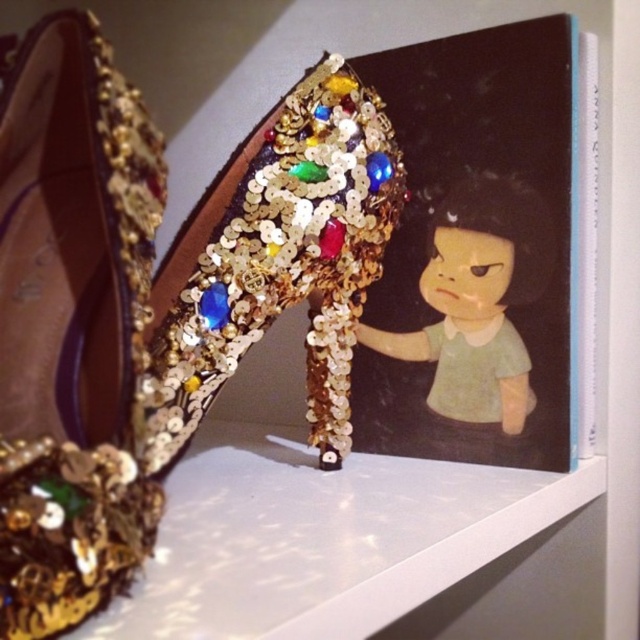
Question: Which point appears closest to the camera in this image?

Choices:
 (A) (524, 381)
 (B) (321, 449)
 (C) (134, 540)

Answer: (C)

Question: Is gold sequined shoe at upper left bigger than gold sequined heel at center?

Choices:
 (A) no
 (B) yes

Answer: (B)

Question: Does gold sequined shoe at upper left have a lesser width compared to gold sequined heel at center?

Choices:
 (A) yes
 (B) no

Answer: (B)

Question: Which of the following is the farthest from the observer?

Choices:
 (A) (330, 468)
 (B) (465, 248)

Answer: (B)

Question: Among these points, which one is farthest from the camera?

Choices:
 (A) (86, 369)
 (B) (362, 420)

Answer: (B)

Question: Is gold sequined shoe at upper left smaller than gold sequined heel at center?

Choices:
 (A) yes
 (B) no

Answer: (B)